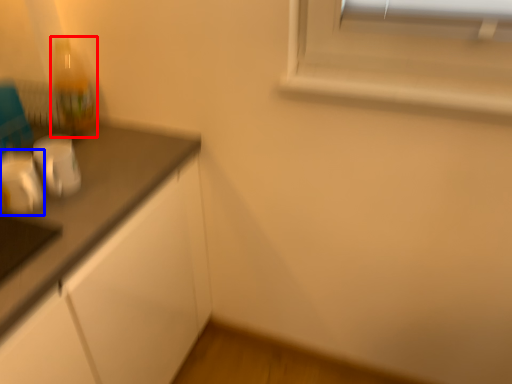
Question: Which of the following is the farthest to the observer, bottle (highlighted by a red box) or appliance (highlighted by a blue box)?

Choices:
 (A) bottle
 (B) appliance

Answer: (A)